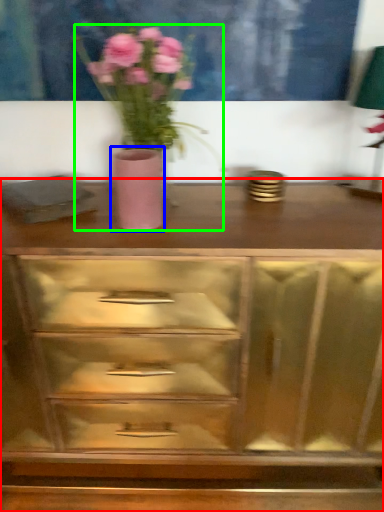
Question: Considering the real-world distances, which object is farthest from chest of drawers (highlighted by a red box)? vase (highlighted by a blue box) or floral arrangement (highlighted by a green box)?

Choices:
 (A) vase
 (B) floral arrangement

Answer: (A)